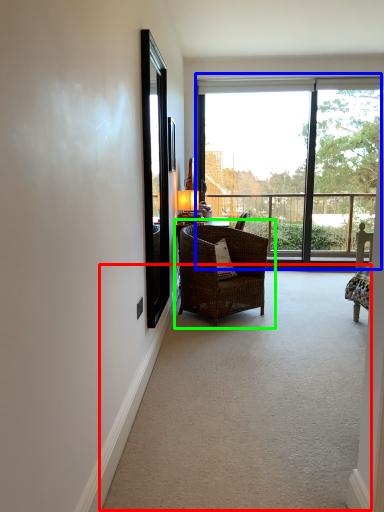
Question: Which object is positioned closest to corridor (highlighted by a red box)? Select from window (highlighted by a blue box) and chair (highlighted by a green box).

Choices:
 (A) window
 (B) chair

Answer: (B)